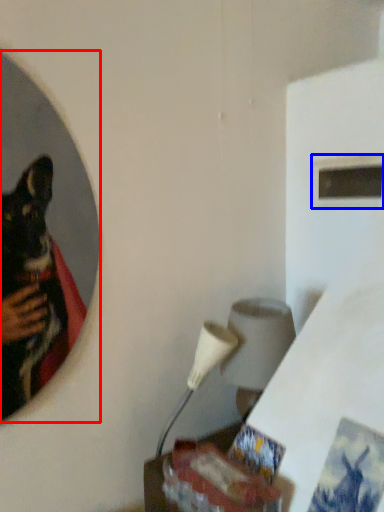
Question: Among these objects, which one is nearest to the camera, mirror (highlighted by a red box) or window (highlighted by a blue box)?

Choices:
 (A) mirror
 (B) window

Answer: (A)